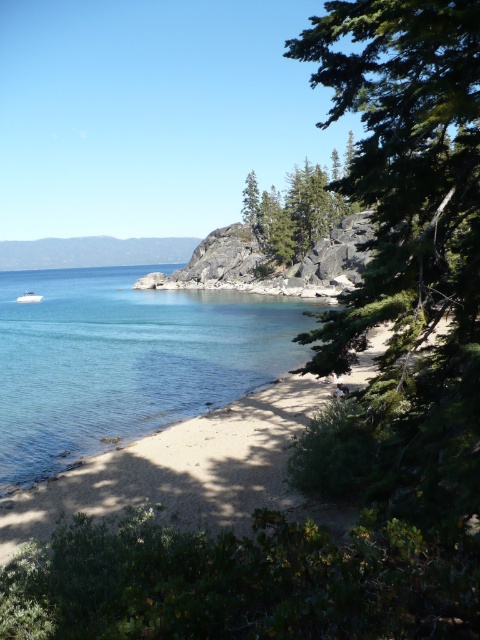
Does clear water at lower left have a lesser width compared to white glossy boat at lower left?

Incorrect, clear water at lower left's width is not less than white glossy boat at lower left's.

What do you see at coordinates (126, 358) in the screenshot?
I see `clear water at lower left` at bounding box center [126, 358].

Locate an element on the screen. This screenshot has height=640, width=480. clear water at lower left is located at coordinates (126, 358).

In the scene shown: Who is more distant from viewer, [289,227] or [25,292]?

Positioned behind is point [25,292].

Can you confirm if green textured rock at center is shorter than white glossy boat at lower left?

No.

Describe the element at coordinates (295, 211) in the screenshot. I see `green textured rock at center` at that location.

Identify the location of green textured rock at center. Image resolution: width=480 pixels, height=640 pixels. (295, 211).

Can you confirm if clear water at lower left is positioned above green textured rock at center?

No.

From the picture: Between clear water at lower left and green textured rock at center, which one is positioned higher?

Positioned higher is green textured rock at center.

This screenshot has width=480, height=640. I want to click on clear water at lower left, so click(126, 358).

The image size is (480, 640). Find the location of `clear water at lower left`. clear water at lower left is located at coordinates (126, 358).